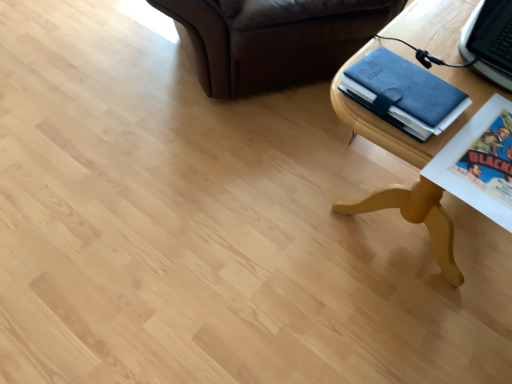
Identify the location of wooden table at lower right. This screenshot has height=384, width=512. (396, 129).

The image size is (512, 384). What do you see at coordinates (396, 129) in the screenshot? I see `wooden table at lower right` at bounding box center [396, 129].

Describe the element at coordinates (403, 93) in the screenshot. I see `blue leather binder at upper right` at that location.

What is the approximate width of blue leather binder at upper right?

blue leather binder at upper right is 9.28 inches in width.

At what (x,y) coordinates should I click in order to perform the action: click on blue leather binder at upper right. Please return your answer as a coordinate pair (x, y). The width and height of the screenshot is (512, 384). Looking at the image, I should click on coord(403,93).

Find the location of a particular element. wooden table at lower right is located at coordinates (396, 129).

Between blue leather binder at upper right and wooden table at lower right, which one appears on the left side from the viewer's perspective?

blue leather binder at upper right.

Does blue leather binder at upper right lie in front of wooden table at lower right?

No, it is behind wooden table at lower right.

Is point (430, 96) positioned after point (402, 154)?

No, it is in front of (402, 154).

From the image's perspective, is blue leather binder at upper right under wooden table at lower right?

Yes, from the image's perspective, blue leather binder at upper right is beneath wooden table at lower right.

From a real-world perspective, is blue leather binder at upper right on top of wooden table at lower right?

Yes.

Between blue leather binder at upper right and wooden table at lower right, which one has larger width?

With larger width is wooden table at lower right.

Is blue leather binder at upper right taller or shorter than wooden table at lower right?

blue leather binder at upper right is shorter than wooden table at lower right.

Can you confirm if blue leather binder at upper right is smaller than wooden table at lower right?

Indeed, blue leather binder at upper right has a smaller size compared to wooden table at lower right.

Is blue leather binder at upper right situated inside wooden table at lower right or outside?

blue leather binder at upper right is not inside wooden table at lower right, it's outside.

Is blue leather binder at upper right not near wooden table at lower right?

That's not correct — blue leather binder at upper right is a little close to wooden table at lower right.

From the picture: Could you tell me if blue leather binder at upper right is turned towards wooden table at lower right?

No, blue leather binder at upper right is not turned towards wooden table at lower right.

Can you tell me how much blue leather binder at upper right and wooden table at lower right differ in facing direction?

The angle between the facing direction of blue leather binder at upper right and the facing direction of wooden table at lower right is 3.32 degrees.

This screenshot has height=384, width=512. In order to click on binder that is below the wooden table at lower right (from the image's perspective) in this screenshot , I will do `click(403, 93)`.

Can you confirm if wooden table at lower right is positioned to the right of blue leather binder at upper right?

Yes, wooden table at lower right is to the right of blue leather binder at upper right.

Is wooden table at lower right in front of or behind blue leather binder at upper right in the image?

In the image, wooden table at lower right appears in front of blue leather binder at upper right.

Which is farther from the camera, (432, 51) or (420, 121)?

Positioned behind is point (432, 51).

From the image's perspective, which one is positioned lower, wooden table at lower right or blue leather binder at upper right?

blue leather binder at upper right appears lower in the image.

Consider the image. From a real-world perspective, which object stands above the other?

In real-world perspective, blue leather binder at upper right is above.

Considering the sizes of wooden table at lower right and blue leather binder at upper right in the image, is wooden table at lower right wider or thinner than blue leather binder at upper right?

Clearly, wooden table at lower right has more width compared to blue leather binder at upper right.

Considering the relative sizes of wooden table at lower right and blue leather binder at upper right in the image provided, is wooden table at lower right shorter than blue leather binder at upper right?

Incorrect, the height of wooden table at lower right does not fall short of that of blue leather binder at upper right.

Is wooden table at lower right bigger or smaller than blue leather binder at upper right?

In the image, wooden table at lower right appears to be larger than blue leather binder at upper right.

Is wooden table at lower right spatially inside blue leather binder at upper right, or outside of it?

wooden table at lower right is spatially situated outside blue leather binder at upper right.

Would you consider wooden table at lower right to be distant from blue leather binder at upper right?

No.

Is wooden table at lower right positioned with its back to blue leather binder at upper right?

No.

What's the angular difference between wooden table at lower right and blue leather binder at upper right's facing directions?

They differ by 3.32 degrees in their facing directions.

This screenshot has width=512, height=384. I want to click on binder lying on the left of wooden table at lower right, so click(403, 93).

Locate an element on the screen. The image size is (512, 384). table located above the blue leather binder at upper right (from the image's perspective) is located at coordinates (396, 129).

Where is `table below the blue leather binder at upper right (from a real-world perspective)`? table below the blue leather binder at upper right (from a real-world perspective) is located at coordinates (396, 129).